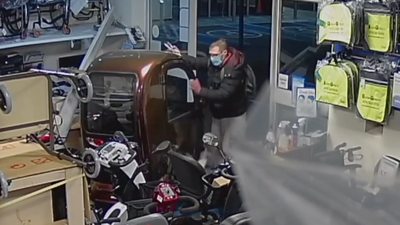
Where is `hood`? The width and height of the screenshot is (400, 225). hood is located at coordinates (237, 58).